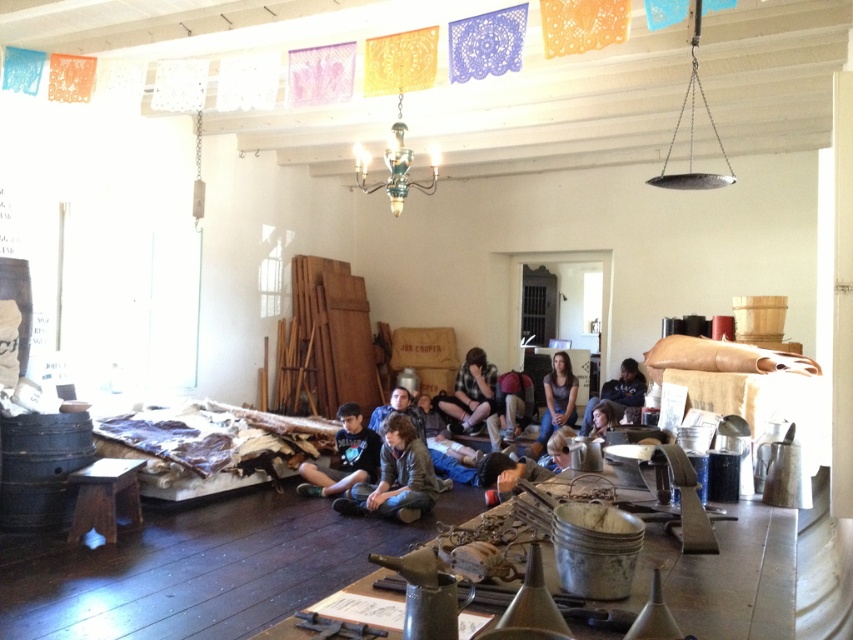
You are standing in the room and want to hang a picture frame on the wall behind the metallic chandelier at upper center and the matte brown backpack at center. Which object is closer to the wall so that you can reach it first without moving any items?

The metallic chandelier at upper center is closer to the viewer than the matte brown backpack at center, so the backpack is farther from the wall. Therefore, you can reach the wall behind the metallic chandelier at upper center first without moving any items.

You are organizing a clothing store and need to place the brown leather jacket at lower center and the dark brown leather jacket at center on a shelf. Which jacket should you place on the left side of the shelf to ensure they fit properly?

The brown leather jacket at lower center has a smaller width than the dark brown leather jacket at center, so placing the narrower one on the left side would allow both to fit properly on the shelf.